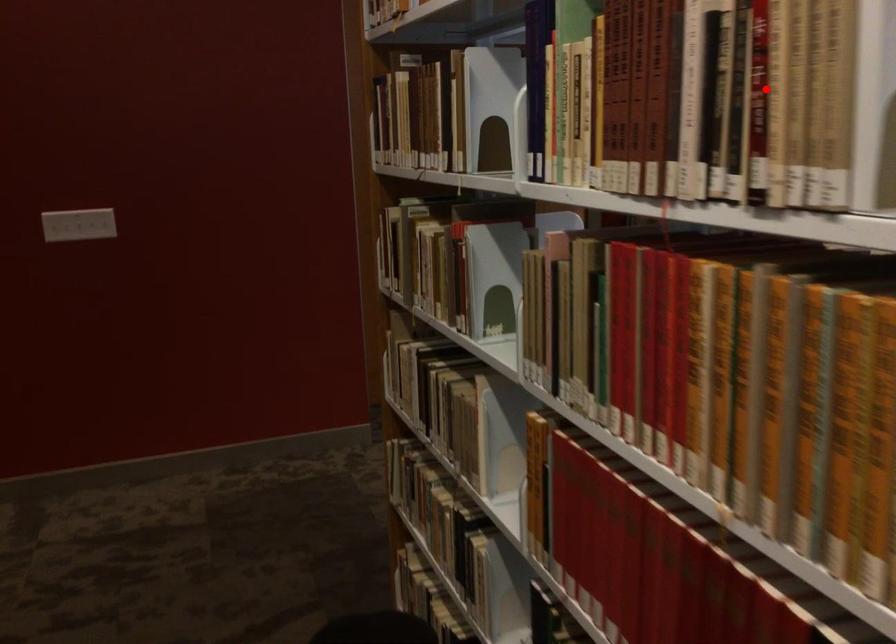
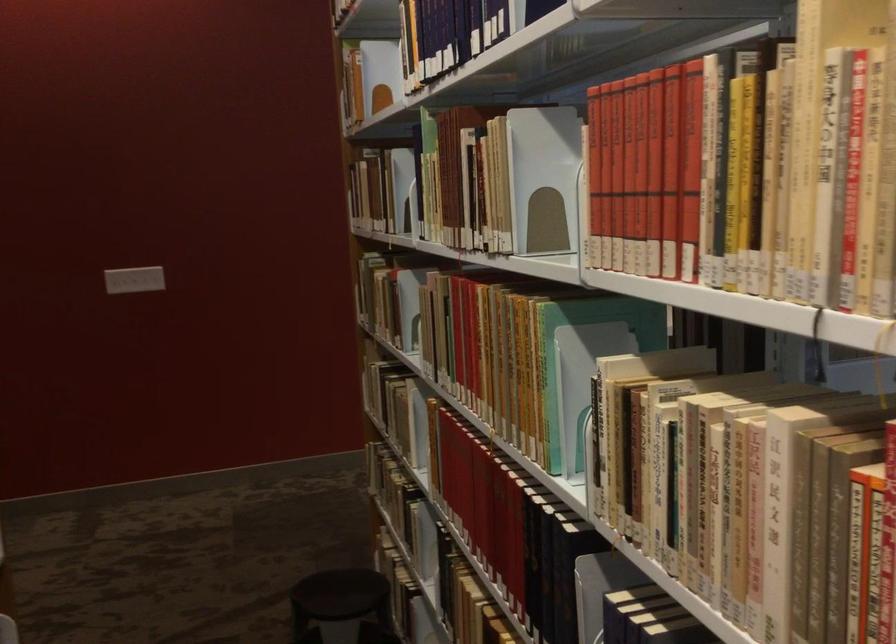
Question: I am providing you with two images of the same scene from different viewpoints. A red point is shown in image1. For the corresponding object point in image2, is it positioned nearer or farther from the camera?

Choices:
 (A) Nearer
 (B) Farther

Answer: (B)